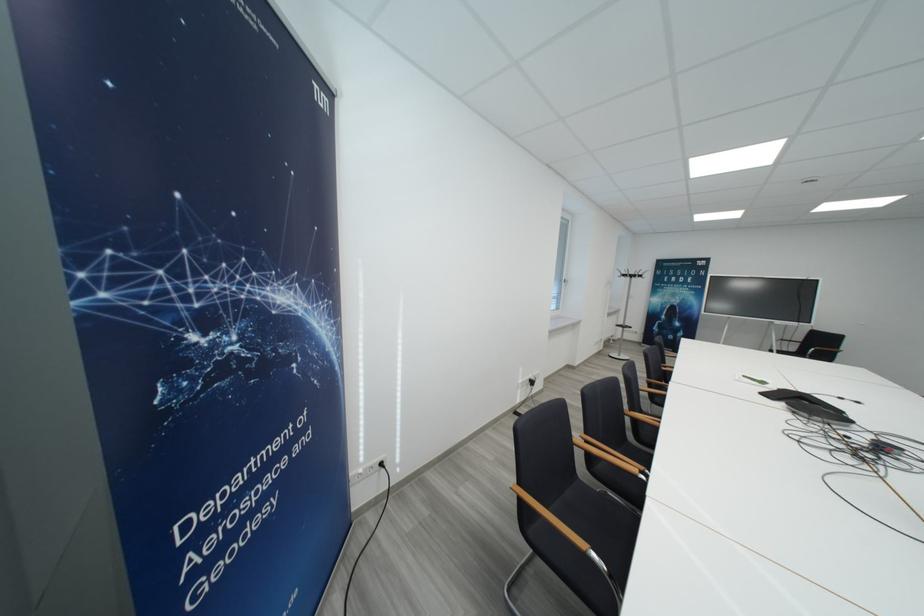
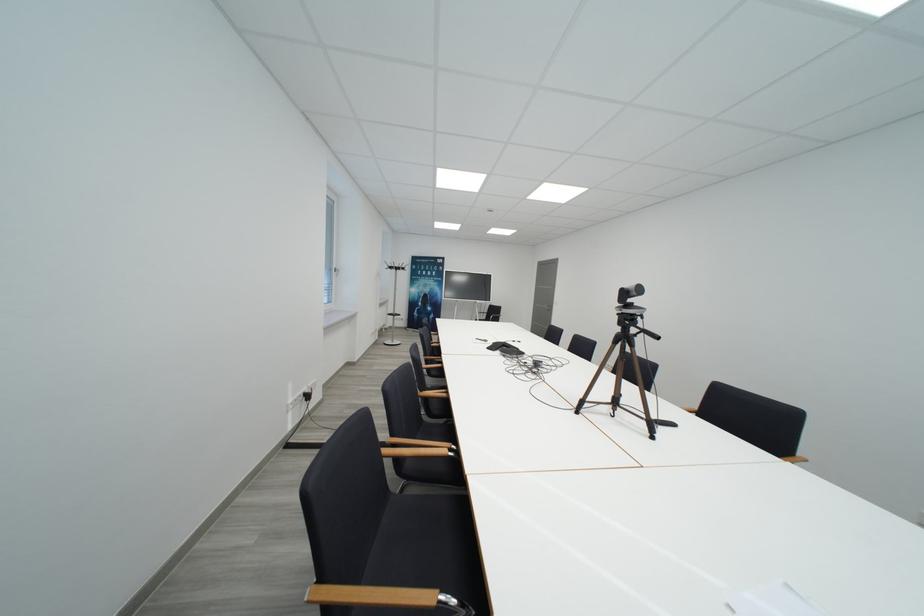
Question: Based on the continuous images, in which direction is the camera rotating? Reply with the corresponding letter.

Choices:
 (A) Left
 (B) Right
 (C) Up
 (D) Down

Answer: (B)